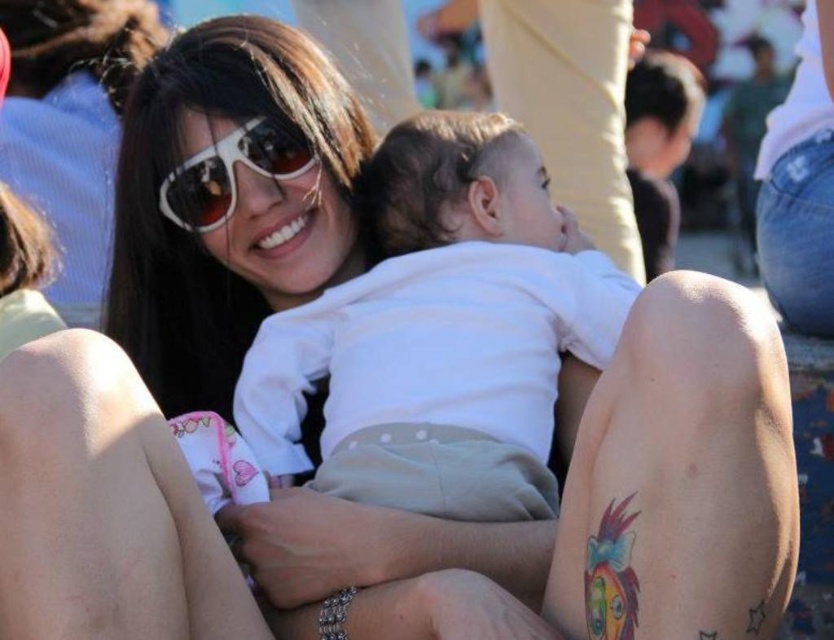
You are a photographer trying to capture a closeup of the white soft fabric baby at center. Based on the coordinates provided, where should you position your camera relative to the baby?

The white soft fabric baby at center is located at coordinates point (x=445, y=316), which is near the center of the image. To capture a closeup, position the camera directly facing the baby at center.

You are a photographer trying to capture the baby in the center of the image. The coordinates provided are point (445, 316). Can you confirm if this point is where the baby is located?

Yes, the point (445, 316) marks the location of the white soft fabric baby at center.

You are a photographer at the event and want to capture a closeup of the baby without the woman blocking the shot. Given the positions of the white soft fabric baby at center and the white glossy sunglasses at upper center, can you position yourself so that the sunglasses are not in the frame?

The white soft fabric baby at center is positioned under the white glossy sunglasses at upper center. To avoid the sunglasses blocking the baby, you can position yourself lower or adjust the angle to frame the baby without including the sunglasses in the shot.